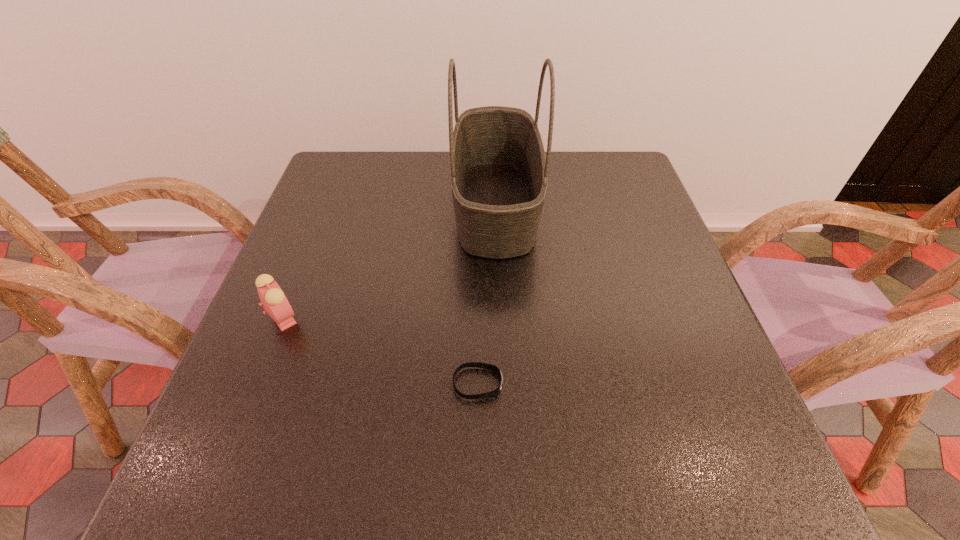
Image resolution: width=960 pixels, height=540 pixels. In order to click on object that is at the left edge in this screenshot , I will do `click(274, 301)`.

At what (x,y) coordinates should I click in order to perform the action: click on vacant space at the far edge. Please return your answer as a coordinate pair (x, y). Looking at the image, I should click on (563, 193).

The width and height of the screenshot is (960, 540). Find the location of `vacant space at the near edge of the desktop`. vacant space at the near edge of the desktop is located at coordinates (355, 448).

Where is `vacant space at the right edge of the desktop`? The height and width of the screenshot is (540, 960). vacant space at the right edge of the desktop is located at coordinates (619, 255).

In the image, there is a desktop. Where is `vacant space at the far left corner`? The image size is (960, 540). vacant space at the far left corner is located at coordinates (369, 180).

Where is `vacant space at the far right corner`? vacant space at the far right corner is located at coordinates (608, 176).

Where is `empty location between the second farthest object and the shortest object`? empty location between the second farthest object and the shortest object is located at coordinates (381, 350).

You are a GUI agent. You are given a task and a screenshot of the screen. Output one action in this format:
    pyautogui.click(x=<x>, y=<y>)
    Task: Click on the vacant region between the basket and the nearest object
    The height and width of the screenshot is (540, 960).
    Given the screenshot: What is the action you would take?
    pyautogui.click(x=487, y=294)

This screenshot has height=540, width=960. In order to click on free space between the nearest object and the basket in this screenshot , I will do `click(487, 294)`.

Identify the location of free space that is in between the tallest object and the alarm clock. (390, 261).